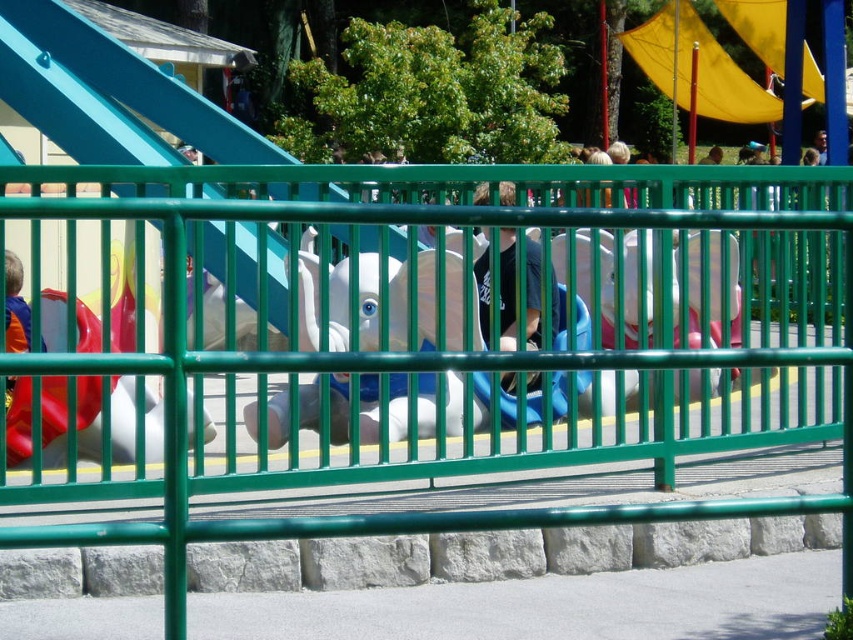
You are a parent trying to locate your child who is playing near the green metal fence at center and the yellow fabric slide at upper center. Based on their positions, which object is closer to the ground?

The green metal fence at center is positioned under the yellow fabric slide at upper center, meaning the fence is closer to the ground while the slide is higher up.

You are a parent trying to guide your child to the yellow fabric slide at upper center. Your child is currently at the white plastic elephant at center. Which direction should they move to reach the slide?

The white plastic elephant at center is positioned on the left side of the yellow fabric slide at upper center, so the child should move to the right to reach the slide.